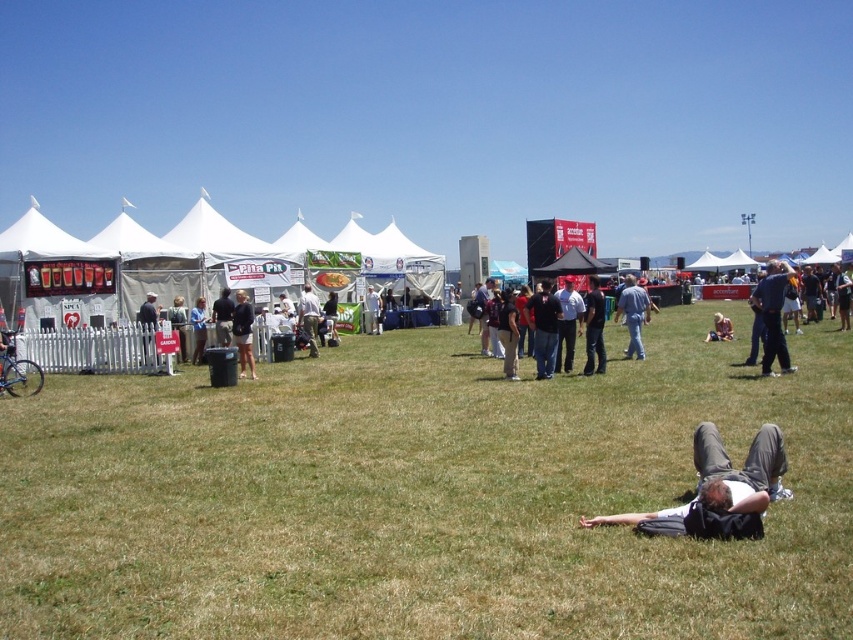
You are a photographer trying to capture a candid shot of the dark gray pants at lower right and the dark red shirt at center. Which object would appear narrower in your photo?

The dark gray pants at lower right would appear narrower in the photo because it is thinner than the dark red shirt at center.